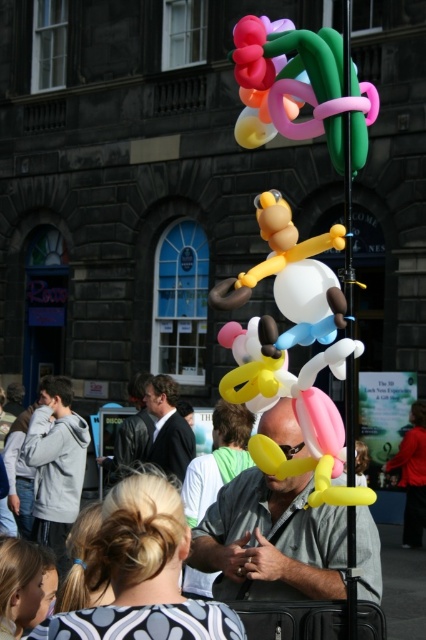
You are a street performer trying to arrange your equipment. You have a glossy balloon sculpture at upper center and a light gray hoodie at left. Which object is wider?

The glossy balloon sculpture at upper center might be wider than the light gray hoodie at left.

You are a customer who wants to buy a balloon sculpture from the man in the image. You are standing at point (55, 465). Which direction should you move to reach the man?

The light gray hoodie at left is located at point (55, 465). Since the man is in the foreground creating balloon sculptures, you should move towards the center or right to reach him from the light gray hoodie at left.

You are a customer who wants to buy the glossy balloon sculpture at upper center. The vendor is wearing a light gray hoodie at left. If you approach the vendor, will the sculpture be in your line of sight while talking to him?

The glossy balloon sculpture at upper center is positioned over the light gray hoodie at left, so when you approach the vendor, the sculpture will be above him in your line of sight.